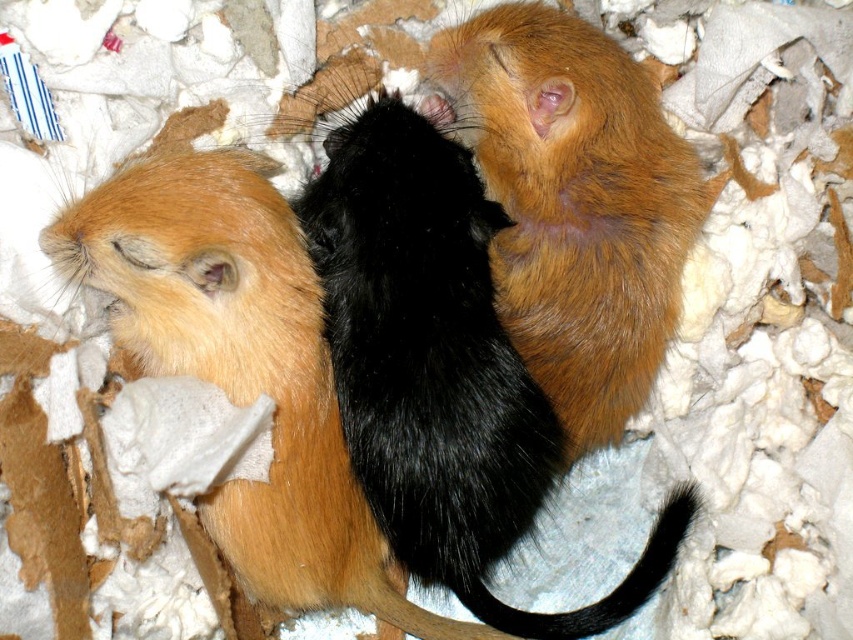
Question: Which is nearer to the black fur hamster at center?

Choices:
 (A) matte black hamster at center
 (B) golden fur hamster at center

Answer: (A)

Question: Observing the image, what is the correct spatial positioning of black fur hamster at center in reference to matte black hamster at center?

Choices:
 (A) above
 (B) below

Answer: (A)

Question: Is the position of golden fur hamster at center less distant than that of black silky tail at center?

Choices:
 (A) yes
 (B) no

Answer: (B)

Question: Which of the following is the closest to the observer?

Choices:
 (A) black fur hamster at center
 (B) black silky tail at center

Answer: (A)

Question: Estimate the real-world distances between objects in this image. Which object is closer to the golden fur hamster at center?

Choices:
 (A) black fur hamster at center
 (B) black silky tail at center
 (C) matte black hamster at center

Answer: (A)

Question: Is matte black hamster at center thinner than golden fur hamster at center?

Choices:
 (A) no
 (B) yes

Answer: (A)